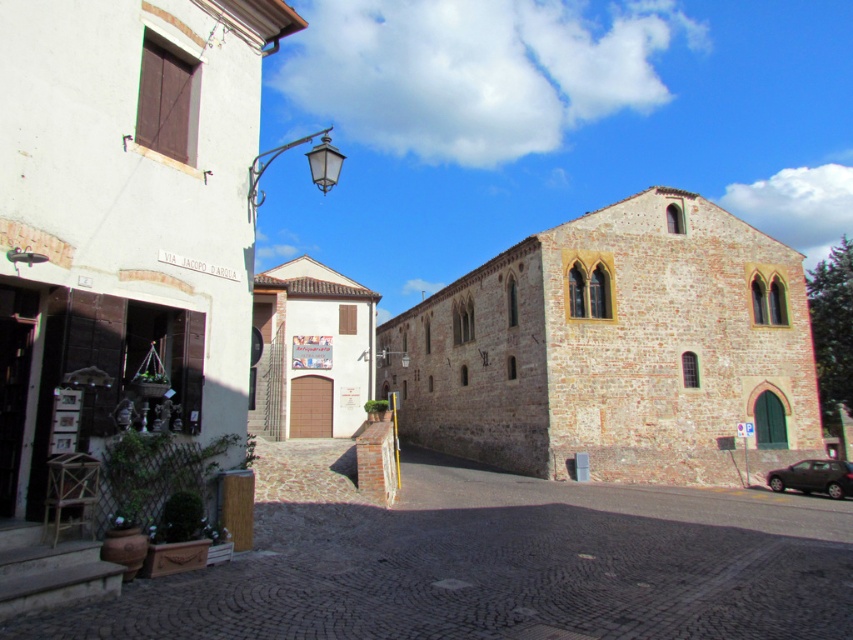
Is point (252, 138) positioned behind point (531, 381)?

No, it is not.

Who is taller, white stone church at left or brown stone church at center?

brown stone church at center is taller.

The height and width of the screenshot is (640, 853). I want to click on white stone church at left, so click(125, 220).

Can you confirm if cobblestone alley at lower left is wider than brown stone church at center?

No, cobblestone alley at lower left is not wider than brown stone church at center.

Is cobblestone alley at lower left positioned behind brown stone church at center?

No, cobblestone alley at lower left is in front of brown stone church at center.

Which is behind, point (379, 548) or point (722, 257)?

Positioned behind is point (722, 257).

This screenshot has height=640, width=853. Find the location of `cobblestone alley at lower left`. cobblestone alley at lower left is located at coordinates (506, 566).

Consider the image. Does white stone church at left have a smaller size compared to white matte church at center?

Yes.

What are the coordinates of `white stone church at left` in the screenshot? It's located at coord(125,220).

Is point (248, 76) farther from viewer compared to point (345, 364)?

That is False.

Locate an element on the screen. Image resolution: width=853 pixels, height=640 pixels. white stone church at left is located at coordinates (125, 220).